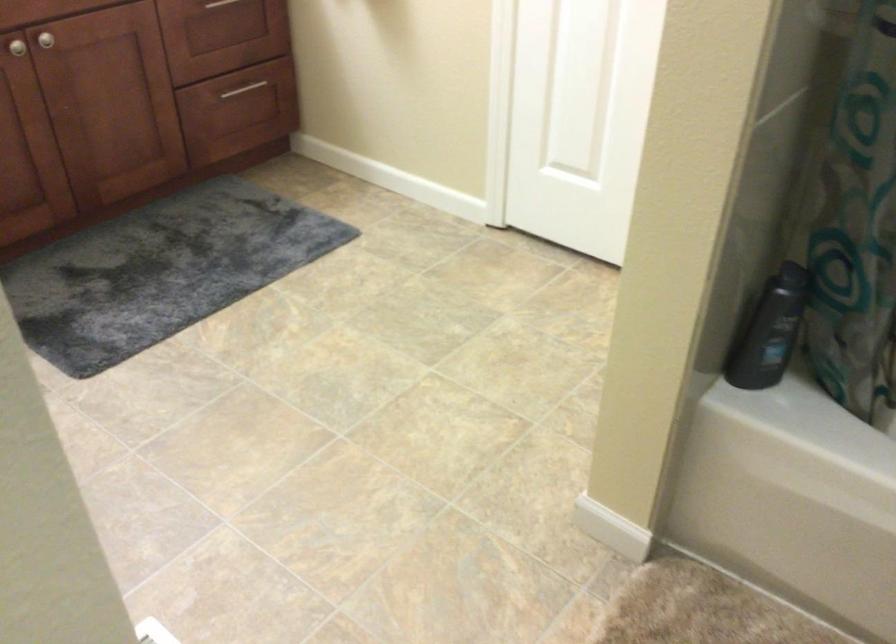
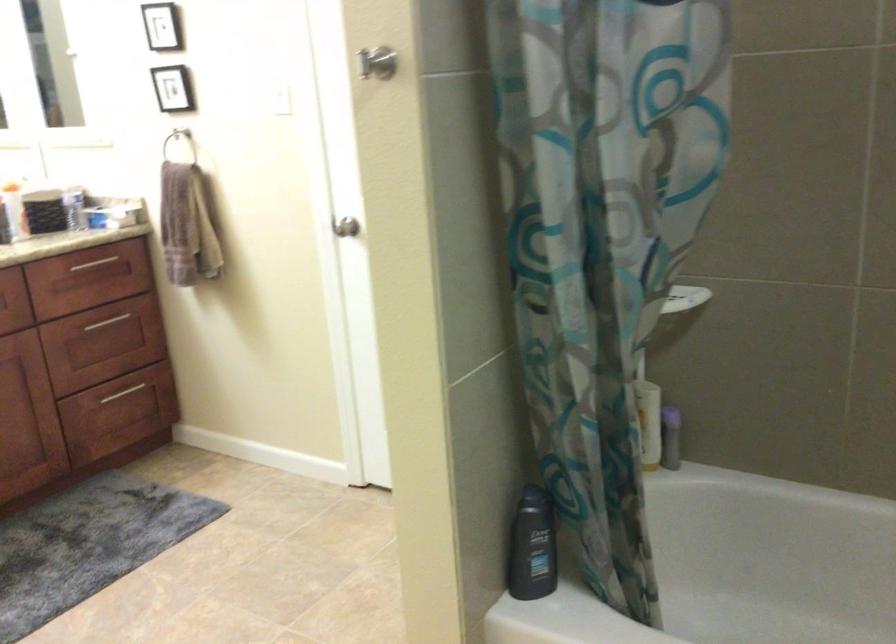
Locate, in the second image, the point that corresponds to pixel 769 334 in the first image.

(531, 547)